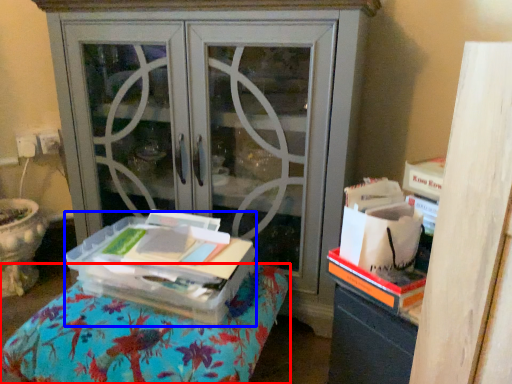
Question: Among these objects, which one is nearest to the camera, furniture (highlighted by a red box) or cardboard box (highlighted by a blue box)?

Choices:
 (A) furniture
 (B) cardboard box

Answer: (A)